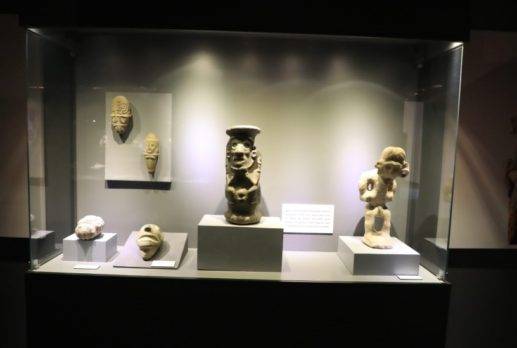
The image size is (517, 348). I want to click on freestanding statues, so click(x=90, y=229), click(x=244, y=189), click(x=379, y=204).